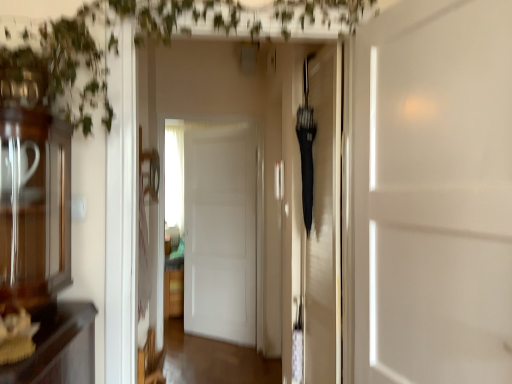
Question: Based on their sizes in the image, would you say black matte umbrella at center, the 2th door positioned from the left, is bigger or smaller than green leafy plant at upper left?

Choices:
 (A) small
 (B) big

Answer: (A)

Question: Choose the correct answer: Is black matte umbrella at center, which is the second door in front-to-back order, inside green leafy plant at upper left or outside it?

Choices:
 (A) inside
 (B) outside

Answer: (B)

Question: Considering the real-world distances, which object is farthest from the green leafy plant at upper left?

Choices:
 (A) black matte umbrella at center, marked as the second door in a right-to-left arrangement
 (B) white matte door at center, marked as the 3th door in a right-to-left arrangement
 (C) white matte door at center, arranged as the first door when viewed from the front

Answer: (B)

Question: Which is nearer to the black matte umbrella at center, the 2th door positioned from the left?

Choices:
 (A) white matte door at center, marked as the 3th door in a right-to-left arrangement
 (B) green leafy plant at upper left
 (C) white matte door at center, the 1th door in the right-to-left sequence

Answer: (C)